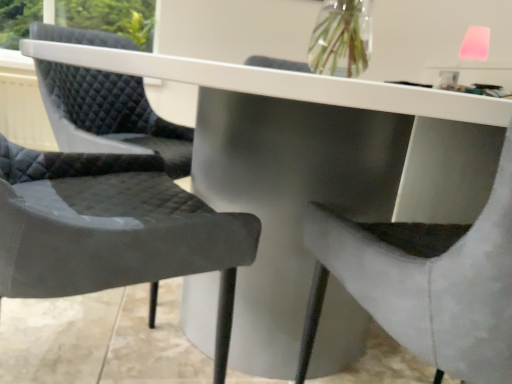
How much space does matte black chair at center, arranged as the 1th chair when viewed from the left, occupy vertically?

It is 33.46 inches.

Looking at this image, measure the distance between matte black chair at center, acting as the second chair starting from the right, and camera.

matte black chair at center, acting as the second chair starting from the right, is 22.78 inches from camera.

What do you see at coordinates (112, 230) in the screenshot? I see `matte black chair at center, arranged as the 1th chair when viewed from the left` at bounding box center [112, 230].

Where is `matte black chair at center, arranged as the 1th chair when viewed from the left`? matte black chair at center, arranged as the 1th chair when viewed from the left is located at coordinates (112, 230).

This screenshot has height=384, width=512. What do you see at coordinates (426, 282) in the screenshot?
I see `suede-like gray chair at center, arranged as the first chair when viewed from the right` at bounding box center [426, 282].

Where is `suede-like gray chair at center, the 2th chair when ordered from left to right`? Image resolution: width=512 pixels, height=384 pixels. suede-like gray chair at center, the 2th chair when ordered from left to right is located at coordinates (426, 282).

Where is `matte black chair at center, acting as the second chair starting from the right`? The image size is (512, 384). matte black chair at center, acting as the second chair starting from the right is located at coordinates (112, 230).

Does suede-like gray chair at center, arranged as the first chair when viewed from the right, appear on the right side of matte black chair at center, acting as the second chair starting from the right?

Indeed, suede-like gray chair at center, arranged as the first chair when viewed from the right, is positioned on the right side of matte black chair at center, acting as the second chair starting from the right.

Does suede-like gray chair at center, the 2th chair when ordered from left to right, lie behind matte black chair at center, acting as the second chair starting from the right?

No, suede-like gray chair at center, the 2th chair when ordered from left to right, is closer to the camera.

Is point (458, 316) positioned in front of point (85, 267)?

Yes, point (458, 316) is closer to viewer.

From the image's perspective, does suede-like gray chair at center, the 2th chair when ordered from left to right, appear higher than matte black chair at center, arranged as the 1th chair when viewed from the left?

No, from the image's perspective, suede-like gray chair at center, the 2th chair when ordered from left to right, is not over matte black chair at center, arranged as the 1th chair when viewed from the left.

From a real-world perspective, who is located lower, suede-like gray chair at center, arranged as the first chair when viewed from the right, or matte black chair at center, acting as the second chair starting from the right?

From a 3D spatial view, suede-like gray chair at center, arranged as the first chair when viewed from the right, is below.

Looking at this image, can you confirm if suede-like gray chair at center, the 2th chair when ordered from left to right, is thinner than matte black chair at center, acting as the second chair starting from the right?

No.

Does suede-like gray chair at center, arranged as the first chair when viewed from the right, have a greater height compared to matte black chair at center, acting as the second chair starting from the right?

No.

Considering the relative sizes of suede-like gray chair at center, the 2th chair when ordered from left to right, and matte black chair at center, arranged as the 1th chair when viewed from the left, in the image provided, is suede-like gray chair at center, the 2th chair when ordered from left to right, smaller than matte black chair at center, arranged as the 1th chair when viewed from the left,?

No, suede-like gray chair at center, the 2th chair when ordered from left to right, is not smaller than matte black chair at center, arranged as the 1th chair when viewed from the left.

Is matte black chair at center, acting as the second chair starting from the right, surrounded by suede-like gray chair at center, arranged as the first chair when viewed from the right?

No, matte black chair at center, acting as the second chair starting from the right, is not a part of suede-like gray chair at center, arranged as the first chair when viewed from the right.

In the scene shown: Is suede-like gray chair at center, the 2th chair when ordered from left to right, next to matte black chair at center, arranged as the 1th chair when viewed from the left?

There is a gap between suede-like gray chair at center, the 2th chair when ordered from left to right, and matte black chair at center, arranged as the 1th chair when viewed from the left.

Is suede-like gray chair at center, the 2th chair when ordered from left to right, oriented towards matte black chair at center, acting as the second chair starting from the right?

No, suede-like gray chair at center, the 2th chair when ordered from left to right, is not facing towards matte black chair at center, acting as the second chair starting from the right.

How many degrees apart are the facing directions of suede-like gray chair at center, arranged as the first chair when viewed from the right, and matte black chair at center, arranged as the 1th chair when viewed from the left?

79.3 degrees.

The width and height of the screenshot is (512, 384). I want to click on chair in front of the matte black chair at center, arranged as the 1th chair when viewed from the left, so click(x=426, y=282).

Considering the positions of objects matte black chair at center, arranged as the 1th chair when viewed from the left, and suede-like gray chair at center, arranged as the first chair when viewed from the right, in the image provided, who is more to the left, matte black chair at center, arranged as the 1th chair when viewed from the left, or suede-like gray chair at center, arranged as the first chair when viewed from the right,?

Positioned to the left is matte black chair at center, arranged as the 1th chair when viewed from the left.

Is matte black chair at center, acting as the second chair starting from the right, in front of or behind suede-like gray chair at center, the 2th chair when ordered from left to right, in the image?

In the image, matte black chair at center, acting as the second chair starting from the right, appears behind suede-like gray chair at center, the 2th chair when ordered from left to right.

Which point is more forward, (197, 261) or (354, 253)?

Positioned in front is point (354, 253).

From the image's perspective, which one is positioned lower, matte black chair at center, arranged as the 1th chair when viewed from the left, or suede-like gray chair at center, arranged as the first chair when viewed from the right?

suede-like gray chair at center, arranged as the first chair when viewed from the right, is shown below in the image.

From a real-world perspective, is matte black chair at center, acting as the second chair starting from the right, positioned above or below suede-like gray chair at center, the 2th chair when ordered from left to right?

From a real-world perspective, matte black chair at center, acting as the second chair starting from the right, is physically above suede-like gray chair at center, the 2th chair when ordered from left to right.

Considering the relative sizes of matte black chair at center, acting as the second chair starting from the right, and suede-like gray chair at center, the 2th chair when ordered from left to right, in the image provided, is matte black chair at center, acting as the second chair starting from the right, thinner than suede-like gray chair at center, the 2th chair when ordered from left to right,?

Yes.

Does matte black chair at center, acting as the second chair starting from the right, have a lesser height compared to suede-like gray chair at center, arranged as the first chair when viewed from the right?

In fact, matte black chair at center, acting as the second chair starting from the right, may be taller than suede-like gray chair at center, arranged as the first chair when viewed from the right.

Which of these two, matte black chair at center, arranged as the 1th chair when viewed from the left, or suede-like gray chair at center, the 2th chair when ordered from left to right, is bigger?

suede-like gray chair at center, the 2th chair when ordered from left to right, is bigger.

Is matte black chair at center, acting as the second chair starting from the right, positioned beyond the bounds of suede-like gray chair at center, the 2th chair when ordered from left to right?

matte black chair at center, acting as the second chair starting from the right, lies outside suede-like gray chair at center, the 2th chair when ordered from left to right,'s area.

Can you see matte black chair at center, acting as the second chair starting from the right, touching suede-like gray chair at center, arranged as the first chair when viewed from the right?

They are not placed beside each other.

Is suede-like gray chair at center, the 2th chair when ordered from left to right, at the back of matte black chair at center, arranged as the 1th chair when viewed from the left?

No, matte black chair at center, arranged as the 1th chair when viewed from the left,'s orientation is not away from suede-like gray chair at center, the 2th chair when ordered from left to right.

Can you tell me how much matte black chair at center, acting as the second chair starting from the right, and suede-like gray chair at center, arranged as the first chair when viewed from the right, differ in facing direction?

There is a 79.3-degree angle between the facing directions of matte black chair at center, acting as the second chair starting from the right, and suede-like gray chair at center, arranged as the first chair when viewed from the right.

Could you measure the distance between matte black chair at center, acting as the second chair starting from the right, and suede-like gray chair at center, the 2th chair when ordered from left to right?

matte black chair at center, acting as the second chair starting from the right, and suede-like gray chair at center, the 2th chair when ordered from left to right, are 34.44 centimeters apart.

The image size is (512, 384). Find the location of `chair lying in front of the matte black chair at center, arranged as the 1th chair when viewed from the left`. chair lying in front of the matte black chair at center, arranged as the 1th chair when viewed from the left is located at coordinates (426, 282).

This screenshot has width=512, height=384. I want to click on chair on the right of the matte black chair at center, arranged as the 1th chair when viewed from the left, so click(426, 282).

At what (x,y) coordinates should I click in order to perform the action: click on chair above the suede-like gray chair at center, the 2th chair when ordered from left to right (from the image's perspective). Please return your answer as a coordinate pair (x, y). Looking at the image, I should click on (112, 230).